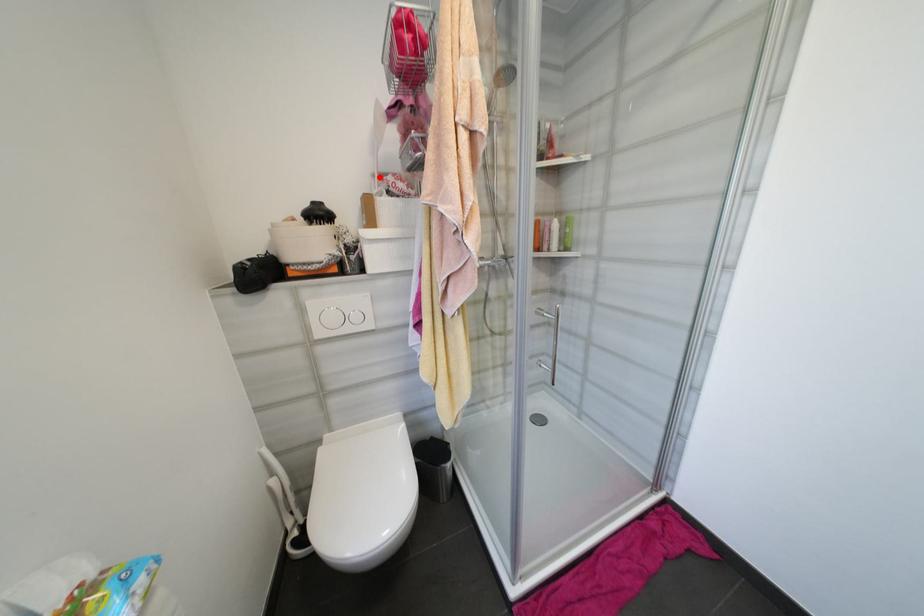
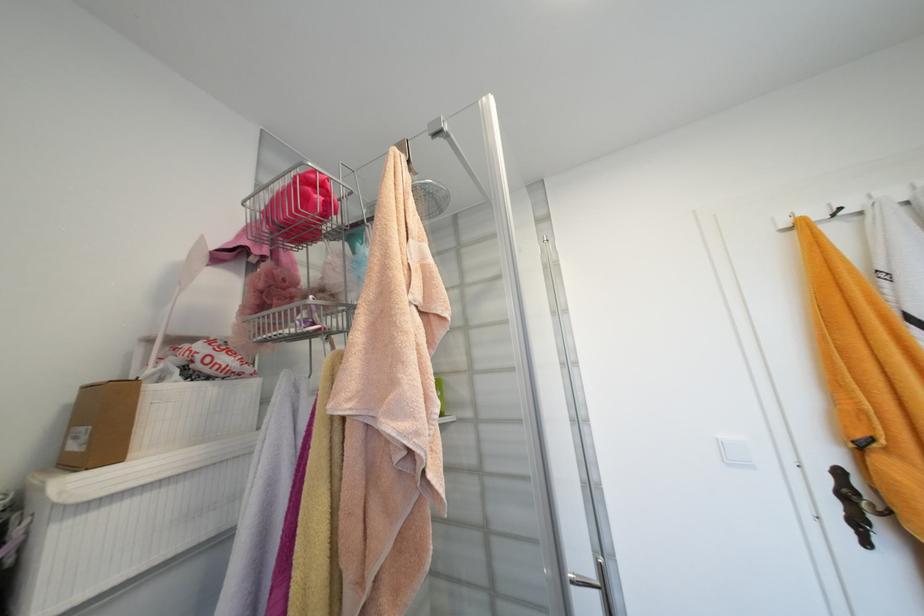
Question: I am providing you with two images of the same scene from different viewpoints. A red point is marked on the first image. At the location where the point appears in image 1, is it still visible in image 2?

Choices:
 (A) Yes
 (B) No

Answer: (A)